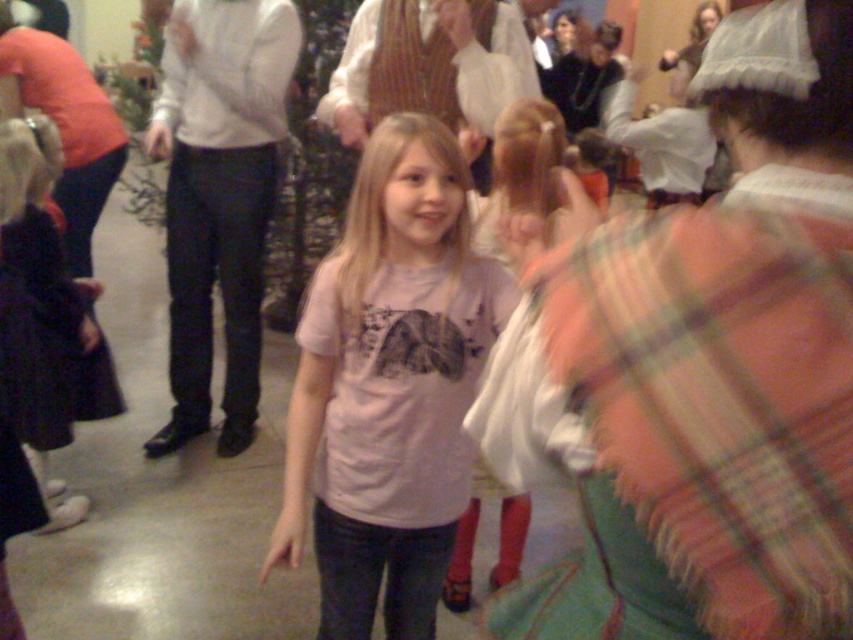
Question: Does pink cotton shirt at center appear on the right side of light pink t-shirt at center?

Choices:
 (A) no
 (B) yes

Answer: (A)

Question: Is pink cotton shirt at center to the right of light pink t-shirt at center from the viewer's perspective?

Choices:
 (A) yes
 (B) no

Answer: (B)

Question: Which point is closer to the camera taking this photo?

Choices:
 (A) (373, 426)
 (B) (523, 180)

Answer: (A)

Question: Is pink cotton shirt at center closer to camera compared to light pink t-shirt at center?

Choices:
 (A) yes
 (B) no

Answer: (A)